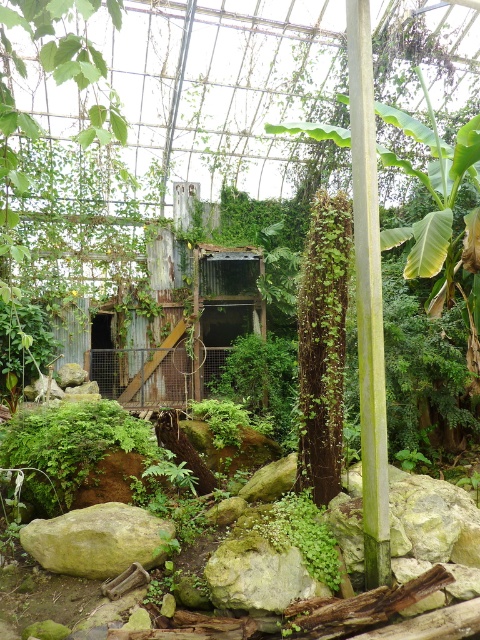
Question: Does green mossy rock at center have a lesser width compared to green mossy rock at lower left?

Choices:
 (A) no
 (B) yes

Answer: (A)

Question: Which object appears closest to the camera in this image?

Choices:
 (A) green mossy rock at lower left
 (B) green mossy rock at center

Answer: (A)

Question: Is green mossy rock at center to the right of green mossy rock at lower left from the viewer's perspective?

Choices:
 (A) no
 (B) yes

Answer: (A)

Question: Can you confirm if green mossy rock at center is bigger than green mossy rock at lower left?

Choices:
 (A) no
 (B) yes

Answer: (B)